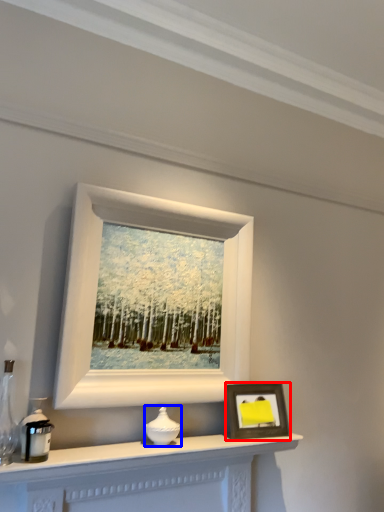
Question: Which point is closer to the camera, picture frame (highlighted by a red box) or candle holder (highlighted by a blue box)?

Choices:
 (A) picture frame
 (B) candle holder

Answer: (B)